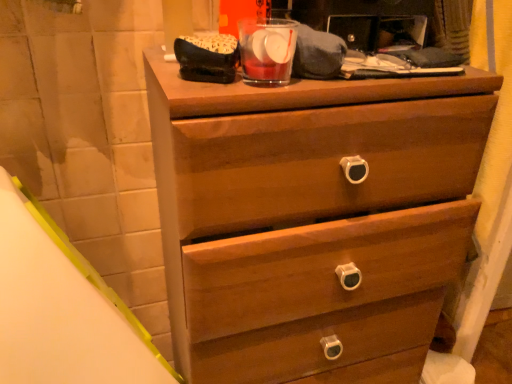
Question: Would you say wooden chest of drawers at center is inside or outside transparent glass at upper center?

Choices:
 (A) inside
 (B) outside

Answer: (B)

Question: Does point (445, 286) appear closer or farther from the camera than point (272, 71)?

Choices:
 (A) farther
 (B) closer

Answer: (A)

Question: Based on their sizes in the image, would you say wooden chest of drawers at center is bigger or smaller than transparent glass at upper center?

Choices:
 (A) big
 (B) small

Answer: (A)

Question: Looking at the image, does transparent glass at upper center seem bigger or smaller compared to wooden chest of drawers at center?

Choices:
 (A) small
 (B) big

Answer: (A)

Question: Considering the positions of point (258, 79) and point (200, 342), is point (258, 79) closer or farther from the camera than point (200, 342)?

Choices:
 (A) closer
 (B) farther

Answer: (A)

Question: Is transparent glass at upper center wider or thinner than wooden chest of drawers at center?

Choices:
 (A) thin
 (B) wide

Answer: (A)

Question: From the image's perspective, is transparent glass at upper center above or below wooden chest of drawers at center?

Choices:
 (A) above
 (B) below

Answer: (A)